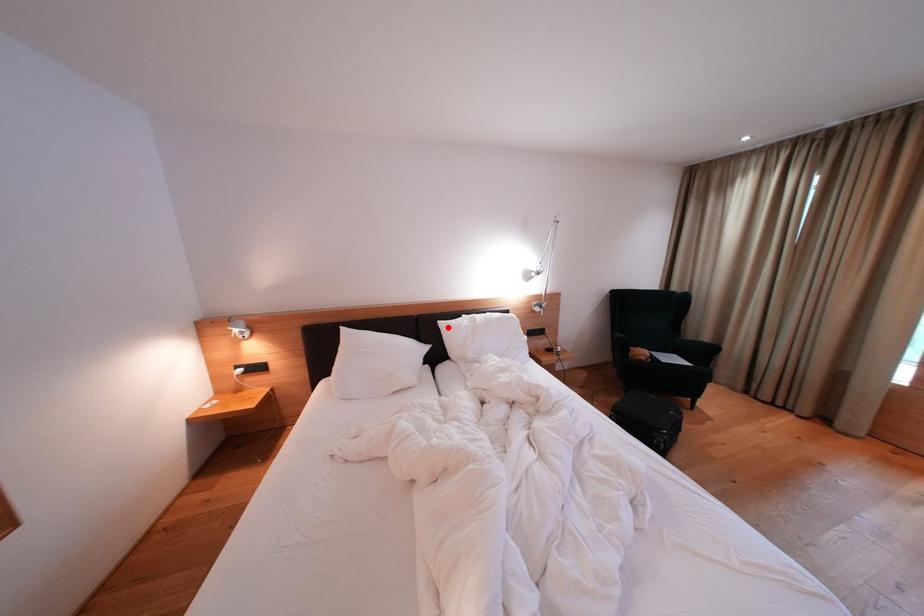
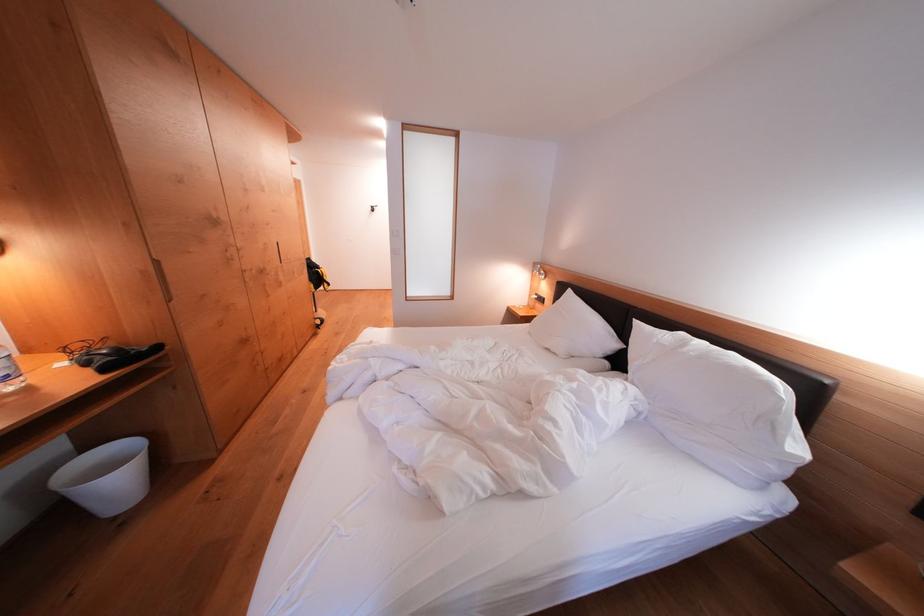
Where in the second image is the point corresponding to the highlighted location from the first image?

(642, 326)